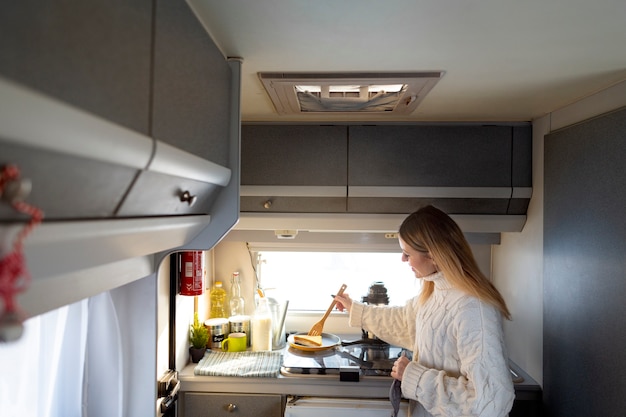
The width and height of the screenshot is (626, 417). Find the location of `drawer`. drawer is located at coordinates click(257, 400).